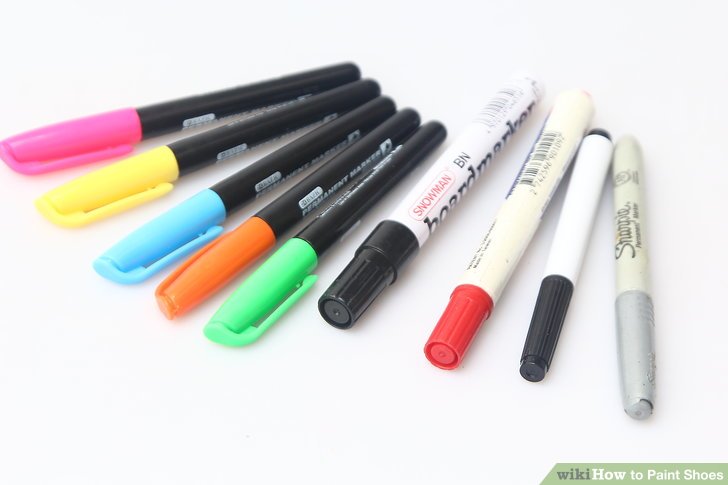
Find the location of a particular element. This screenshot has width=728, height=485. markers is located at coordinates (630, 288), (558, 282), (467, 304), (381, 260), (269, 282), (201, 267), (166, 223), (130, 173), (103, 122).